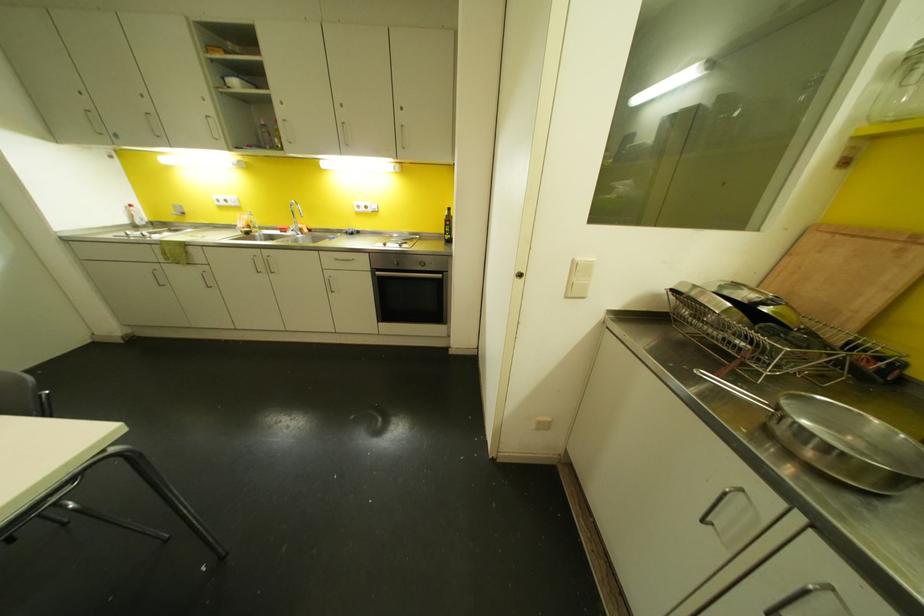
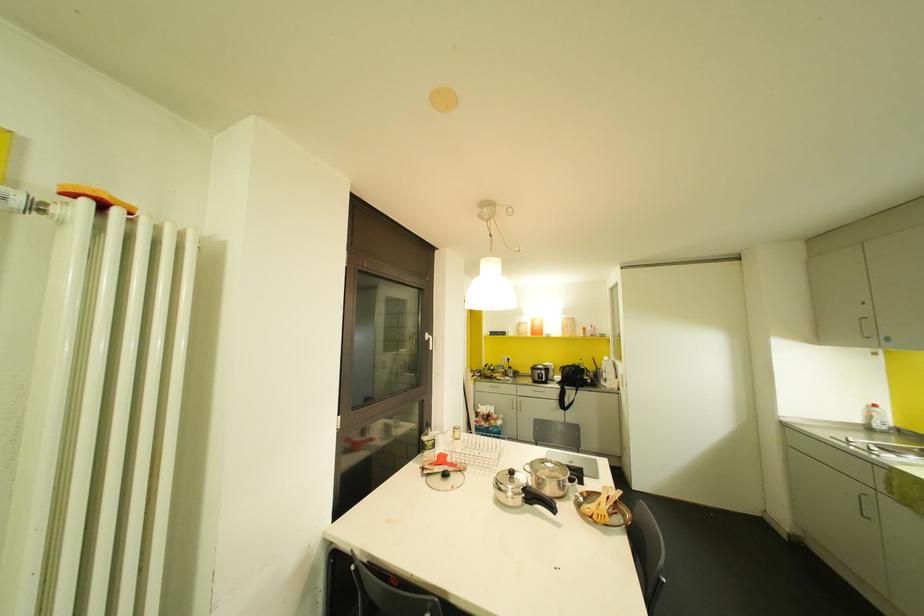
Question: The camera is either moving clockwise (left) or counter-clockwise (right) around the object. The first image is from the beginning of the video and the second image is from the end. Is the camera moving left or right when shooting the video?

Choices:
 (A) Left
 (B) Right

Answer: (B)